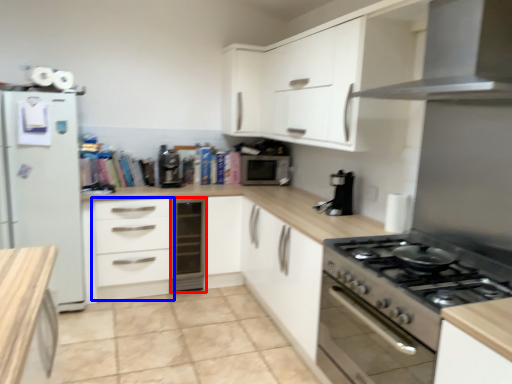
Question: Which object is closer to the camera taking this photo, dish washer (highlighted by a red box) or drawer (highlighted by a blue box)?

Choices:
 (A) dish washer
 (B) drawer

Answer: (B)